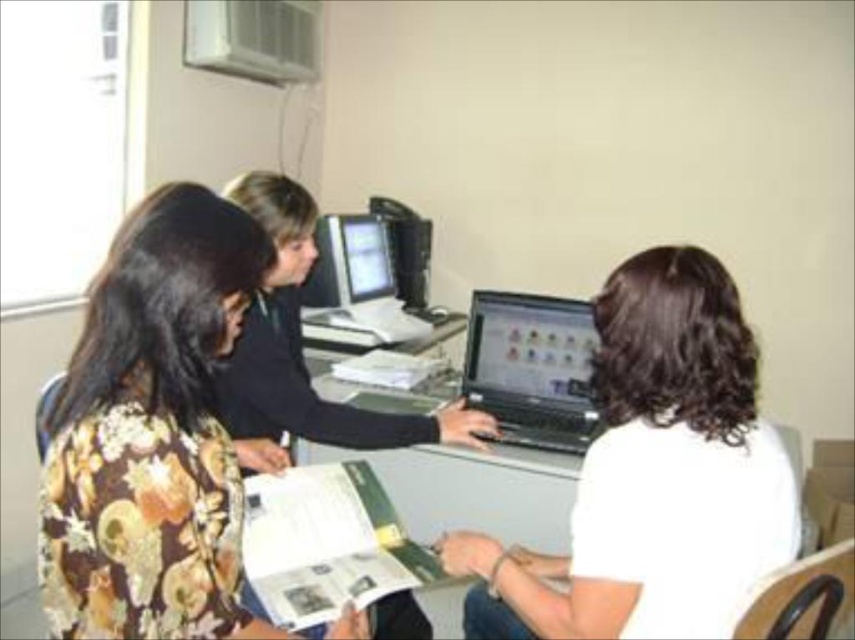
Question: Which point is farther to the camera?

Choices:
 (A) pos(472,556)
 (B) pos(361,396)
 (C) pos(375,289)
 (D) pos(93,467)

Answer: (C)

Question: Estimate the real-world distances between objects in this image. Which object is farther from the white matte laptop at center?

Choices:
 (A) floral fabric blouse at left
 (B) matte plastic monitor at center
 (C) black plastic computer desk at center
 (D) shiny black laptop at center

Answer: (B)

Question: Can you confirm if white matte laptop at center is positioned below matte plastic monitor at center?

Choices:
 (A) no
 (B) yes

Answer: (B)

Question: Does black plastic computer desk at center come in front of matte plastic monitor at center?

Choices:
 (A) no
 (B) yes

Answer: (B)

Question: Does floral fabric blouse at left lie in front of shiny black laptop at center?

Choices:
 (A) no
 (B) yes

Answer: (B)

Question: Which object appears farthest from the camera in this image?

Choices:
 (A) matte plastic monitor at center
 (B) floral fabric blouse at left
 (C) shiny black laptop at center
 (D) white matte laptop at center

Answer: (A)